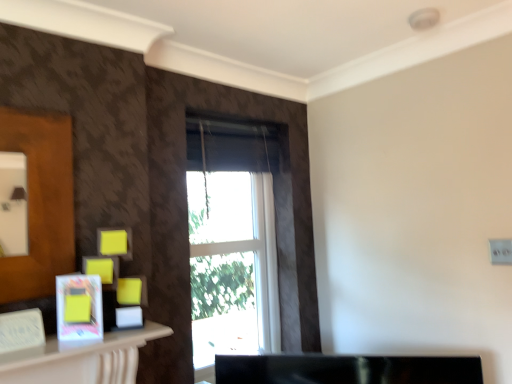
Question: Do you think matte white picture frame at lower left is within white glass window at center, or outside of it?

Choices:
 (A) inside
 (B) outside

Answer: (B)

Question: Is point (73, 324) closer or farther from the camera than point (219, 301)?

Choices:
 (A) closer
 (B) farther

Answer: (A)

Question: From the image's perspective, relative to white glass window at center, is matte white picture frame at lower left above or below?

Choices:
 (A) below
 (B) above

Answer: (A)

Question: Do you think white glass window at center is within matte white picture frame at lower left, or outside of it?

Choices:
 (A) inside
 (B) outside

Answer: (B)

Question: Is white glass window at center in front of or behind matte white picture frame at lower left in the image?

Choices:
 (A) front
 (B) behind

Answer: (B)

Question: Considering the positions of white glass window at center and matte white picture frame at lower left in the image, is white glass window at center bigger or smaller than matte white picture frame at lower left?

Choices:
 (A) big
 (B) small

Answer: (A)

Question: From a real-world perspective, is white glass window at center physically located above or below matte white picture frame at lower left?

Choices:
 (A) below
 (B) above

Answer: (B)